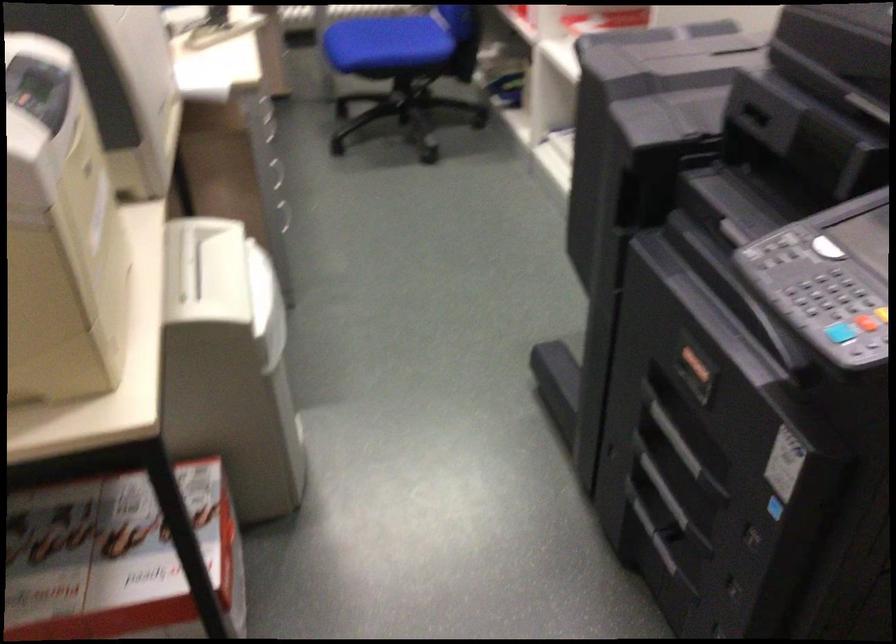
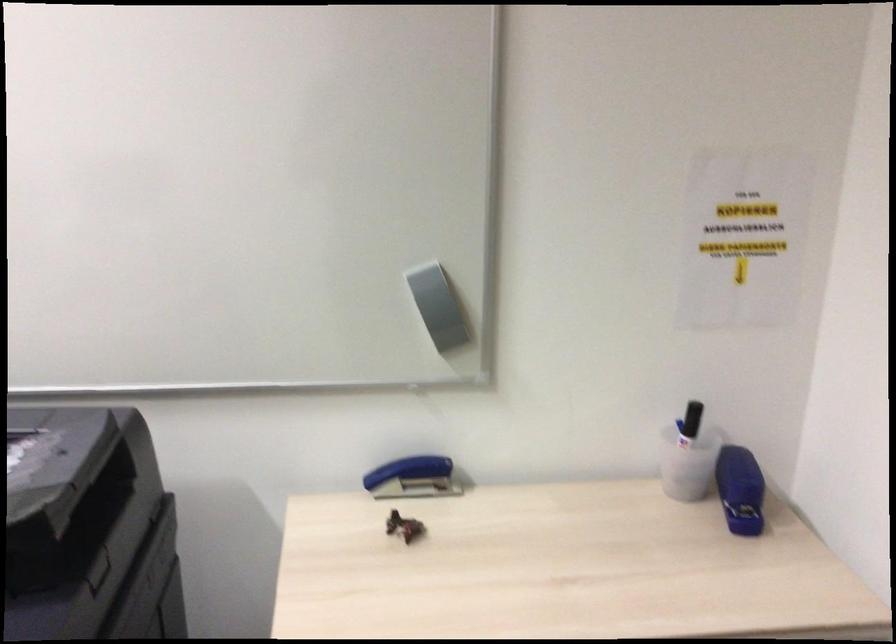
Question: The camera is either moving clockwise (left) or counter-clockwise (right) around the object. The first image is from the beginning of the video and the second image is from the end. Is the camera moving left or right when shooting the video?

Choices:
 (A) Left
 (B) Right

Answer: (A)